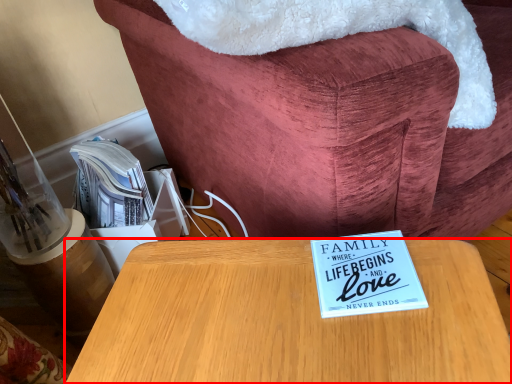
Question: Where is table (annotated by the red box) located in relation to furniture in the image?

Choices:
 (A) left
 (B) right

Answer: (A)